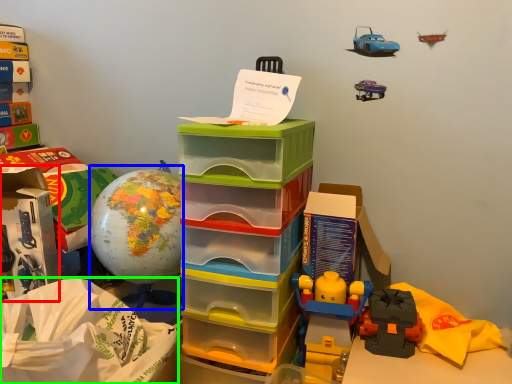
Question: Considering the real-world distances, which object is farthest from storage box (highlighted by a red box)? toy (highlighted by a blue box) or paper bag (highlighted by a green box)?

Choices:
 (A) toy
 (B) paper bag

Answer: (B)